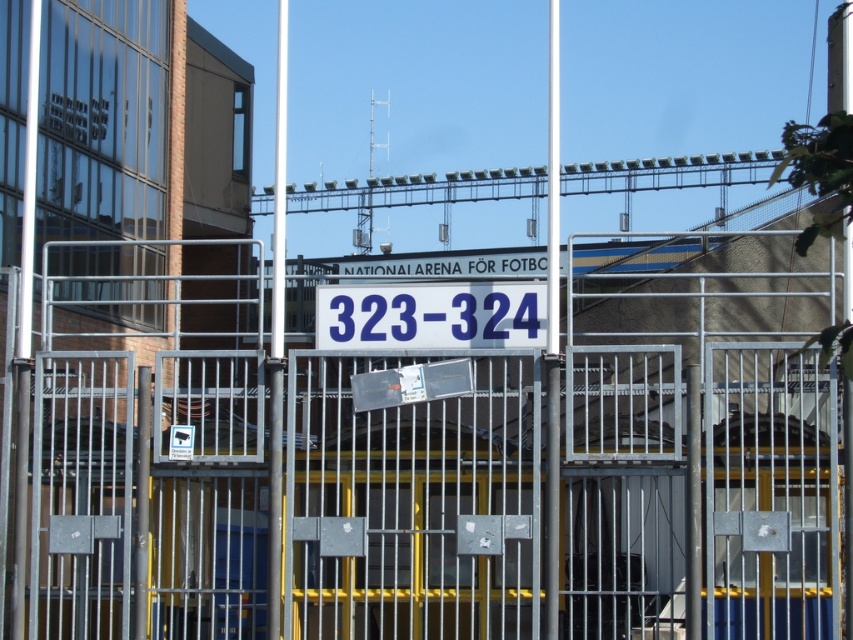
Between metallic gate at center and blue plastic sign at center, which one appears on the left side from the viewer's perspective?

Positioned to the left is metallic gate at center.

Is metallic gate at center below blue plastic sign at center?

Actually, metallic gate at center is above blue plastic sign at center.

Locate an element on the screen. The width and height of the screenshot is (853, 640). metallic gate at center is located at coordinates (437, 476).

This screenshot has height=640, width=853. I want to click on metallic gate at center, so click(437, 476).